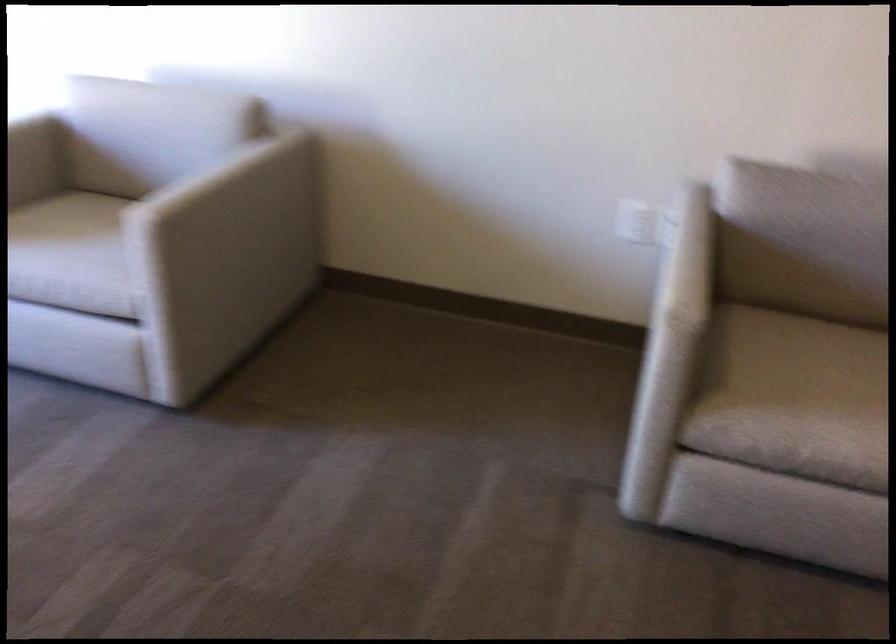
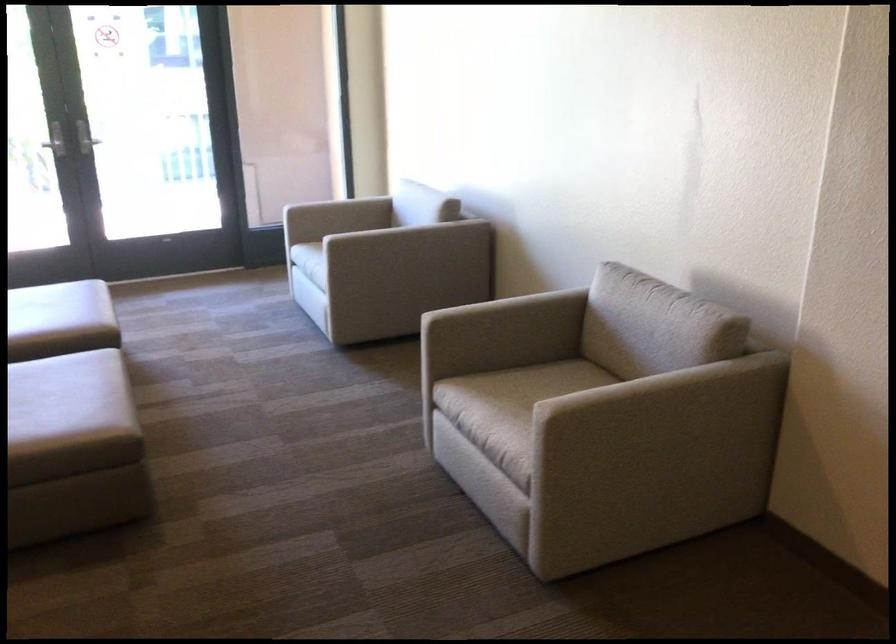
Locate, in the second image, the point that corresponds to point (100, 125) in the first image.

(375, 200)